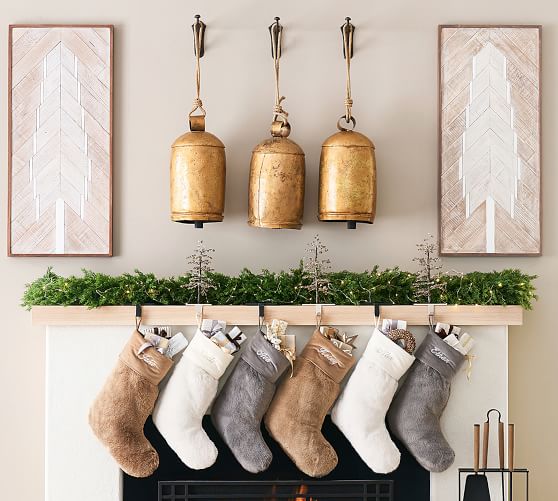
Locate an element on the screen. wreath is located at coordinates (400, 334).